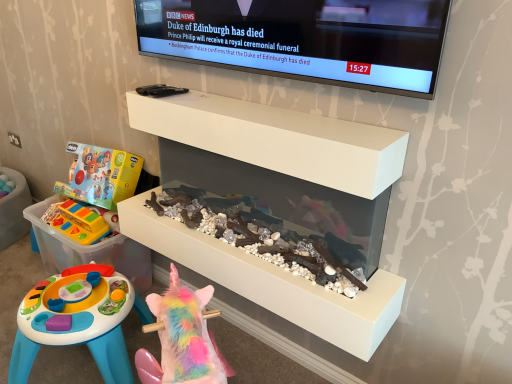
You are a GUI agent. You are given a task and a screenshot of the screen. Output one action in this format:
    pyautogui.click(x=<x>, y=<y>)
    Task: Click on the free point above white matte shelf at upper center (from a real-world perspective)
    This screenshot has height=384, width=512.
    Given the screenshot: What is the action you would take?
    pyautogui.click(x=245, y=106)